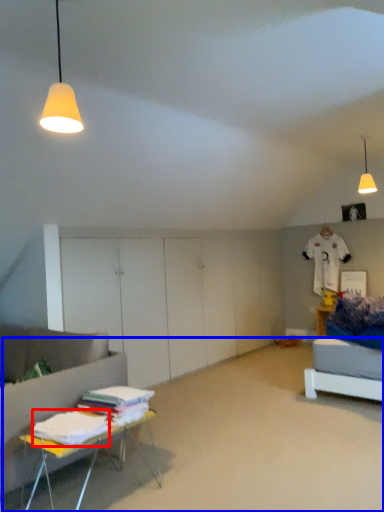
Question: Which object is closer to the camera taking this photo, sheet (highlighted by a red box) or plain (highlighted by a blue box)?

Choices:
 (A) sheet
 (B) plain

Answer: (B)